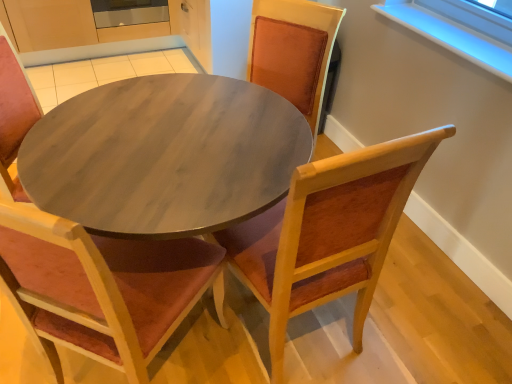
The image size is (512, 384). I want to click on wooden chair at center, acting as the 2th chair starting from the left, so tap(328, 233).

Measure the distance between point [373,292] and camera.

A distance of 4.78 feet exists between point [373,292] and camera.

What is the approximate height of wooden chair at center, acting as the 2th chair starting from the left?

wooden chair at center, acting as the 2th chair starting from the left, is 3.32 feet tall.

Describe the element at coordinates (328, 233) in the screenshot. I see `wooden chair at center, which ranks as the 1th chair in right-to-left order` at that location.

Measure the distance between wooden chair with velvet cushion at center, acting as the first chair starting from the left, and camera.

A distance of 1.18 meters exists between wooden chair with velvet cushion at center, acting as the first chair starting from the left, and camera.

Where is `wooden chair with velvet cushion at center, acting as the first chair starting from the left`? This screenshot has width=512, height=384. wooden chair with velvet cushion at center, acting as the first chair starting from the left is located at coordinates (14, 114).

Consider the image. How much space does wooden chair with velvet cushion at center, acting as the first chair starting from the left, occupy horizontally?

21.84 inches.

Image resolution: width=512 pixels, height=384 pixels. Describe the element at coordinates (14, 114) in the screenshot. I see `wooden chair with velvet cushion at center, arranged as the 2th chair when viewed from the right` at that location.

In order to face wooden chair with velvet cushion at center, arranged as the 2th chair when viewed from the right, should I rotate leftwards or rightwards?

It's best to rotate left around 18.412 degrees.

The image size is (512, 384). I want to click on wooden chair at center, which ranks as the 1th chair in right-to-left order, so click(x=328, y=233).

Is wooden chair at center, acting as the 2th chair starting from the left, to the right of wooden chair with velvet cushion at center, arranged as the 2th chair when viewed from the right, from the viewer's perspective?

Correct, you'll find wooden chair at center, acting as the 2th chair starting from the left, to the right of wooden chair with velvet cushion at center, arranged as the 2th chair when viewed from the right.

Considering the positions of objects wooden chair at center, acting as the 2th chair starting from the left, and wooden chair with velvet cushion at center, arranged as the 2th chair when viewed from the right, in the image provided, who is in front, wooden chair at center, acting as the 2th chair starting from the left, or wooden chair with velvet cushion at center, arranged as the 2th chair when viewed from the right,?

Positioned in front is wooden chair with velvet cushion at center, arranged as the 2th chair when viewed from the right.

Is point (310, 247) in front of point (20, 78)?

That is True.

From the image's perspective, is wooden chair at center, which ranks as the 1th chair in right-to-left order, beneath wooden chair with velvet cushion at center, arranged as the 2th chair when viewed from the right?

No.

Based on the photo, from a real-world perspective, is wooden chair at center, which ranks as the 1th chair in right-to-left order, beneath wooden chair with velvet cushion at center, acting as the first chair starting from the left?

No, from a real-world perspective, wooden chair at center, which ranks as the 1th chair in right-to-left order, is not beneath wooden chair with velvet cushion at center, acting as the first chair starting from the left.

Can you confirm if wooden chair at center, acting as the 2th chair starting from the left, is thinner than wooden chair with velvet cushion at center, acting as the first chair starting from the left?

Yes, wooden chair at center, acting as the 2th chair starting from the left, is thinner than wooden chair with velvet cushion at center, acting as the first chair starting from the left.

Considering the sizes of objects wooden chair at center, which ranks as the 1th chair in right-to-left order, and wooden chair with velvet cushion at center, arranged as the 2th chair when viewed from the right, in the image provided, who is shorter, wooden chair at center, which ranks as the 1th chair in right-to-left order, or wooden chair with velvet cushion at center, arranged as the 2th chair when viewed from the right,?

With less height is wooden chair at center, which ranks as the 1th chair in right-to-left order.

Does wooden chair at center, which ranks as the 1th chair in right-to-left order, have a larger size compared to wooden chair with velvet cushion at center, acting as the first chair starting from the left?

Actually, wooden chair at center, which ranks as the 1th chair in right-to-left order, might be smaller than wooden chair with velvet cushion at center, acting as the first chair starting from the left.

Is wooden chair with velvet cushion at center, acting as the first chair starting from the left, located within wooden chair at center, acting as the 2th chair starting from the left?

No, wooden chair with velvet cushion at center, acting as the first chair starting from the left, is not surrounded by wooden chair at center, acting as the 2th chair starting from the left.

Is wooden chair at center, which ranks as the 1th chair in right-to-left order, far away from wooden chair with velvet cushion at center, acting as the first chair starting from the left?

No.

Looking at this image, is wooden chair at center, acting as the 2th chair starting from the left, oriented away from wooden chair with velvet cushion at center, acting as the first chair starting from the left?

No, wooden chair at center, acting as the 2th chair starting from the left,'s orientation is not away from wooden chair with velvet cushion at center, acting as the first chair starting from the left.

You are a GUI agent. You are given a task and a screenshot of the screen. Output one action in this format:
    pyautogui.click(x=<x>, y=<y>)
    Task: Click on the chair above the wooden chair with velvet cushion at center, arranged as the 2th chair when viewed from the right (from a real-world perspective)
    
    Given the screenshot: What is the action you would take?
    pyautogui.click(x=328, y=233)

Can you confirm if wooden chair with velvet cushion at center, arranged as the 2th chair when viewed from the right, is positioned to the right of wooden chair at center, which ranks as the 1th chair in right-to-left order?

No.

Is the position of wooden chair with velvet cushion at center, acting as the first chair starting from the left, more distant than that of wooden chair at center, acting as the 2th chair starting from the left?

That is False.

Is point (28, 123) positioned in front of point (239, 229)?

No, it is not.

From the image's perspective, is wooden chair with velvet cushion at center, arranged as the 2th chair when viewed from the right, located beneath wooden chair at center, which ranks as the 1th chair in right-to-left order?

Yes, from the image's perspective, wooden chair with velvet cushion at center, arranged as the 2th chair when viewed from the right, is below wooden chair at center, which ranks as the 1th chair in right-to-left order.

From a real-world perspective, is wooden chair with velvet cushion at center, arranged as the 2th chair when viewed from the right, located higher than wooden chair at center, which ranks as the 1th chair in right-to-left order?

No, from a real-world perspective, wooden chair with velvet cushion at center, arranged as the 2th chair when viewed from the right, is not above wooden chair at center, which ranks as the 1th chair in right-to-left order.

Does wooden chair with velvet cushion at center, arranged as the 2th chair when viewed from the right, have a lesser width compared to wooden chair at center, which ranks as the 1th chair in right-to-left order?

In fact, wooden chair with velvet cushion at center, arranged as the 2th chair when viewed from the right, might be wider than wooden chair at center, which ranks as the 1th chair in right-to-left order.

Between wooden chair with velvet cushion at center, arranged as the 2th chair when viewed from the right, and wooden chair at center, acting as the 2th chair starting from the left, which one has more height?

wooden chair with velvet cushion at center, arranged as the 2th chair when viewed from the right, is taller.

Is wooden chair with velvet cushion at center, arranged as the 2th chair when viewed from the right, smaller than wooden chair at center, acting as the 2th chair starting from the left?

No.

In the scene shown: Is wooden chair with velvet cushion at center, acting as the first chair starting from the left, surrounding wooden chair at center, acting as the 2th chair starting from the left?

No.

Is wooden chair with velvet cushion at center, acting as the first chair starting from the left, in contact with wooden chair at center, which ranks as the 1th chair in right-to-left order?

No, wooden chair with velvet cushion at center, acting as the first chair starting from the left, is not touching wooden chair at center, which ranks as the 1th chair in right-to-left order.

Is wooden chair with velvet cushion at center, arranged as the 2th chair when viewed from the right, oriented towards wooden chair at center, acting as the 2th chair starting from the left?

No.

How many degrees apart are the facing directions of wooden chair with velvet cushion at center, arranged as the 2th chair when viewed from the right, and wooden chair at center, acting as the 2th chair starting from the left?

They differ by 46.4 degrees in their facing directions.

Where is `chair to the left of wooden chair at center, acting as the 2th chair starting from the left`? This screenshot has width=512, height=384. chair to the left of wooden chair at center, acting as the 2th chair starting from the left is located at coordinates (14, 114).

Locate an element on the screen. chair behind the wooden chair with velvet cushion at center, arranged as the 2th chair when viewed from the right is located at coordinates (328, 233).

Where is `chair located in front of the wooden chair at center, acting as the 2th chair starting from the left`? This screenshot has height=384, width=512. chair located in front of the wooden chair at center, acting as the 2th chair starting from the left is located at coordinates (14, 114).